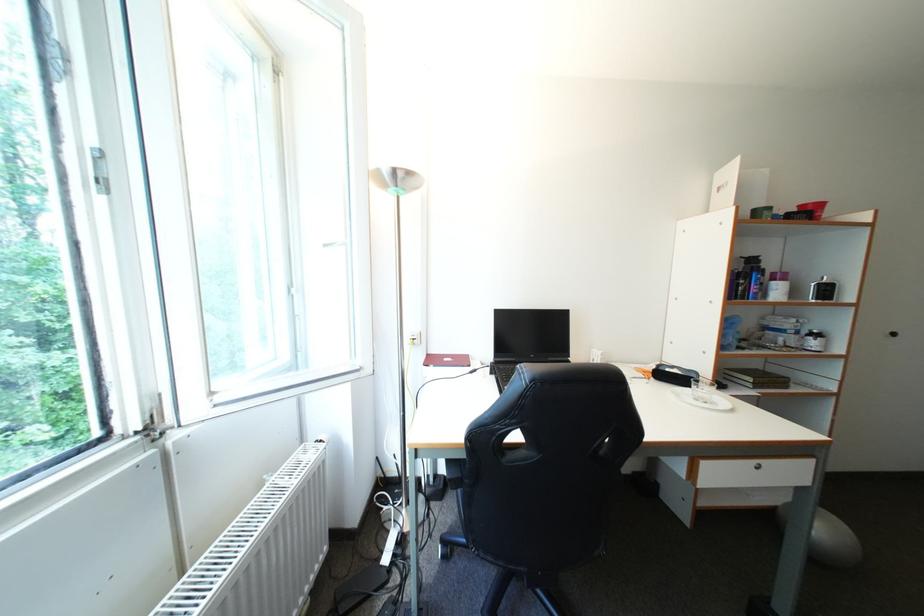
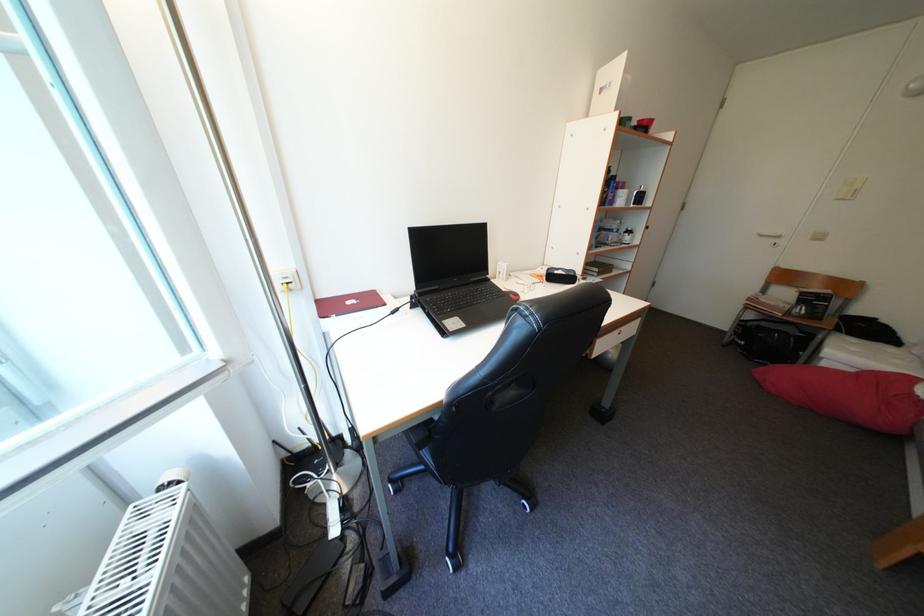
First-person continuous shooting, in which direction is the camera rotating?

The camera rotated toward right-down.